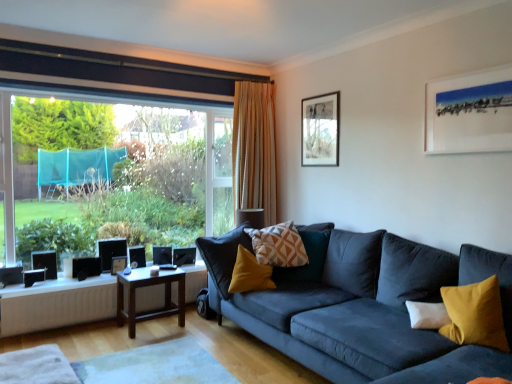
Image resolution: width=512 pixels, height=384 pixels. Find the location of `vacant space in white matte radiator at lower left (from a real-world perspective)`. vacant space in white matte radiator at lower left (from a real-world perspective) is located at coordinates (68, 327).